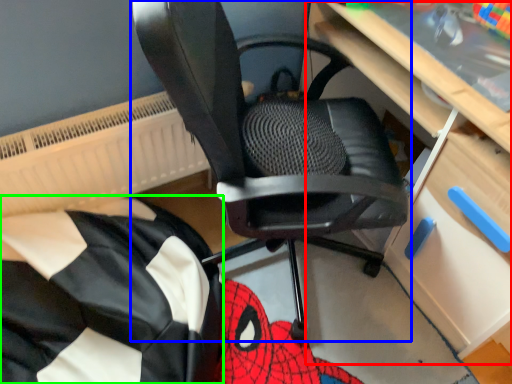
Question: Based on their relative distances, which object is farther from computer desk (highlighted by a red box)? Choose from chair (highlighted by a blue box) and bean bag chair (highlighted by a green box).

Choices:
 (A) chair
 (B) bean bag chair

Answer: (B)